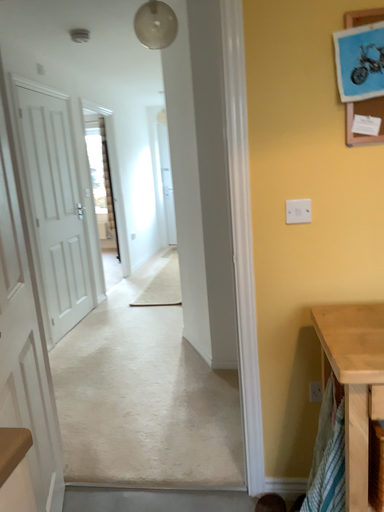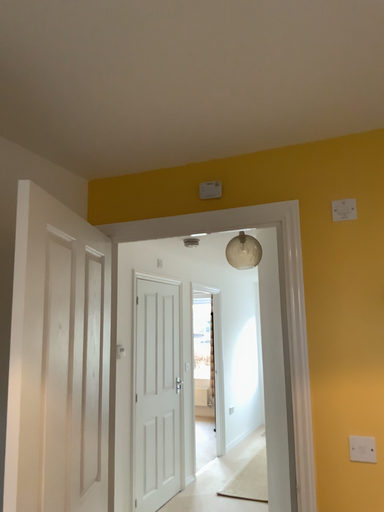
Question: Which way did the camera rotate in the video?

Choices:
 (A) rotated left
 (B) rotated right

Answer: (A)